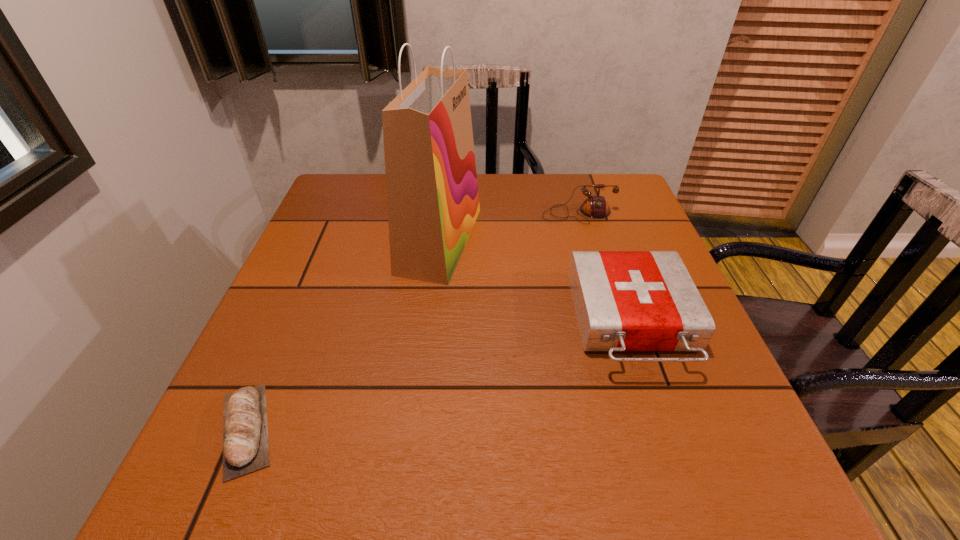
In the image, there is a desktop. Find the location of `vacant space at the right edge`. vacant space at the right edge is located at coordinates (606, 241).

Image resolution: width=960 pixels, height=540 pixels. What are the coordinates of `free location at the far left corner` in the screenshot? It's located at (372, 177).

Image resolution: width=960 pixels, height=540 pixels. In the image, there is a desktop. What are the coordinates of `vacant space at the far right corner` in the screenshot? It's located at (589, 176).

The width and height of the screenshot is (960, 540). Find the location of `vacant space at the near right corner of the desktop`. vacant space at the near right corner of the desktop is located at coordinates (743, 464).

Identify the location of vacant region between the first-aid kit and the shopping bag. (536, 281).

Find the location of a particular element. The height and width of the screenshot is (540, 960). blank region between the tallest object and the leftmost object is located at coordinates (343, 335).

Where is `vacant area between the first-aid kit and the shortest object`? vacant area between the first-aid kit and the shortest object is located at coordinates (439, 375).

I want to click on free space between the telephone and the shortest object, so click(x=412, y=321).

In order to click on vacant point located between the telephone and the nearest object in this screenshot , I will do `click(412, 321)`.

Where is `vacant space in between the telephone and the pita bread`? vacant space in between the telephone and the pita bread is located at coordinates (412, 321).